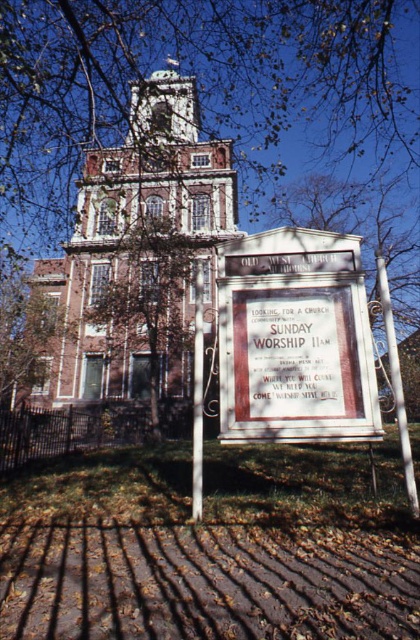
Between brown leafy tree at upper center and white wooden sign at center, which one appears on the right side from the viewer's perspective?

From the viewer's perspective, white wooden sign at center appears more on the right side.

Image resolution: width=420 pixels, height=640 pixels. What are the coordinates of `brown leafy tree at upper center` in the screenshot? It's located at (196, 81).